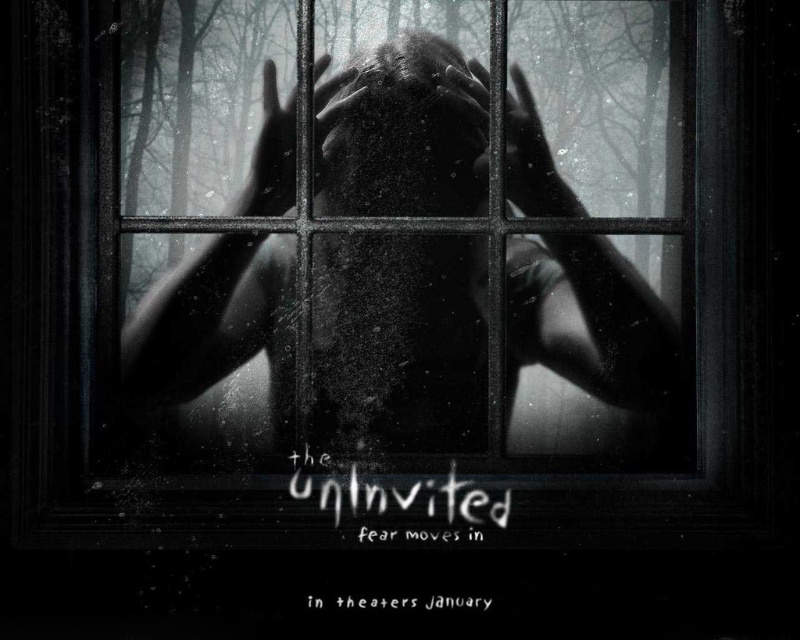
Who is lower down, translucent flesh at center or smooth skin face at center?

Positioned lower is translucent flesh at center.

Does point (293, 262) lie in front of point (437, 99)?

Yes, it is.

The height and width of the screenshot is (640, 800). I want to click on translucent flesh at center, so click(398, 342).

Identify the location of translucent flesh at center. This screenshot has width=800, height=640. (398, 342).

Locate an element on the screen. translucent flesh at center is located at coordinates (398, 342).

Is translucent flesh at center taller than smooth skin hand at center?

Yes, translucent flesh at center is taller than smooth skin hand at center.

You are a GUI agent. You are given a task and a screenshot of the screen. Output one action in this format:
    pyautogui.click(x=<x>, y=<y>)
    Task: Click on the translucent flesh at center
    The image size is (800, 640).
    Given the screenshot: What is the action you would take?
    pyautogui.click(x=398, y=342)

Locate an element on the screen. The height and width of the screenshot is (640, 800). translucent flesh at center is located at coordinates (398, 342).

Based on the photo, does black matte hand at center have a greater width compared to smooth skin hand at center?

Yes.

Does black matte hand at center have a larger size compared to smooth skin hand at center?

No, black matte hand at center is not bigger than smooth skin hand at center.

This screenshot has height=640, width=800. I want to click on black matte hand at center, so click(528, 156).